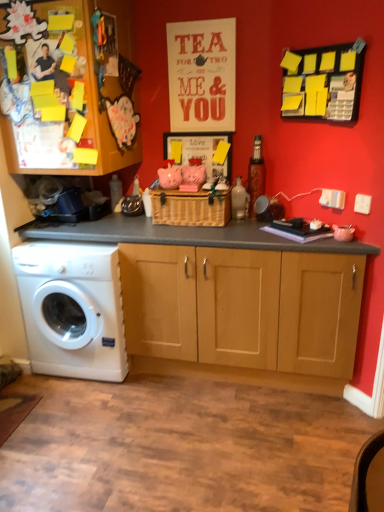
Question: Considering the relative sizes of white plastic washing machine at lower left and woven brown basket at center in the image provided, is white plastic washing machine at lower left bigger than woven brown basket at center?

Choices:
 (A) no
 (B) yes

Answer: (B)

Question: Is woven brown basket at center inside white plastic washing machine at lower left?

Choices:
 (A) no
 (B) yes

Answer: (A)

Question: Does white plastic washing machine at lower left appear on the left side of woven brown basket at center?

Choices:
 (A) no
 (B) yes

Answer: (B)

Question: Is white plastic washing machine at lower left not within woven brown basket at center?

Choices:
 (A) yes
 (B) no

Answer: (A)

Question: Is white plastic washing machine at lower left smaller than woven brown basket at center?

Choices:
 (A) yes
 (B) no

Answer: (B)

Question: Is wooden cabinet at center taller or shorter than woven brown basket at center?

Choices:
 (A) short
 (B) tall

Answer: (B)

Question: Considering the positions of wooden cabinet at center and woven brown basket at center in the image, is wooden cabinet at center bigger or smaller than woven brown basket at center?

Choices:
 (A) big
 (B) small

Answer: (A)

Question: Based on their positions, is wooden cabinet at center located to the left or right of woven brown basket at center?

Choices:
 (A) right
 (B) left

Answer: (B)

Question: Is point (130, 44) positioned closer to the camera than point (228, 212)?

Choices:
 (A) closer
 (B) farther

Answer: (B)

Question: Looking at their shapes, would you say woven brown basket at center is wider or thinner than wooden cabinet at center?

Choices:
 (A) wide
 (B) thin

Answer: (B)

Question: Which is correct: woven brown basket at center is inside wooden cabinet at center, or outside of it?

Choices:
 (A) outside
 (B) inside

Answer: (A)

Question: In terms of size, does woven brown basket at center appear bigger or smaller than wooden cabinet at center?

Choices:
 (A) big
 (B) small

Answer: (B)

Question: From the image's perspective, is woven brown basket at center above or below wooden cabinet at center?

Choices:
 (A) above
 (B) below

Answer: (B)

Question: Visually, is woven brown basket at center positioned to the left or to the right of yellow sticky notes at upper right?

Choices:
 (A) right
 (B) left

Answer: (B)

Question: Is woven brown basket at center inside or outside of yellow sticky notes at upper right?

Choices:
 (A) inside
 (B) outside

Answer: (B)